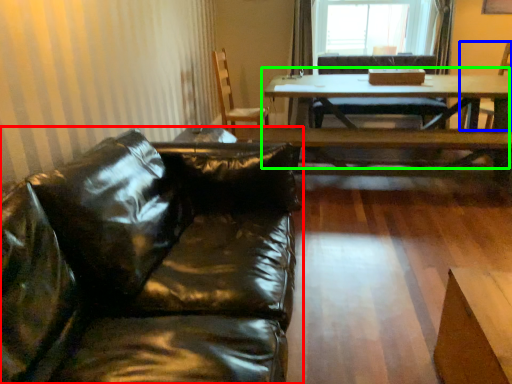
Question: Which object is the closest to the studio couch (highlighted by a red box)? Choose among these: armchair (highlighted by a blue box) or table (highlighted by a green box).

Choices:
 (A) armchair
 (B) table

Answer: (B)